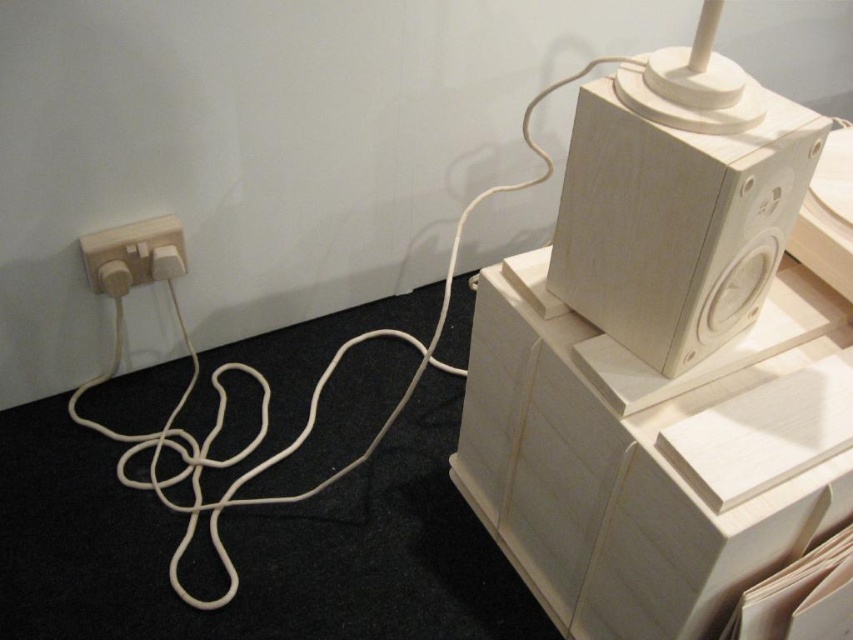
Between wooden speaker at upper right and white matte rope at lower left, which one appears on the right side from the viewer's perspective?

wooden speaker at upper right

Between wooden speaker at upper right and white matte rope at lower left, which one appears on the left side from the viewer's perspective?

white matte rope at lower left

Is point (744, 324) positioned in front of point (457, 220)?

That is True.

Identify the location of wooden speaker at upper right. This screenshot has height=640, width=853. (676, 218).

Can you confirm if white matte rope at lower left is positioned above white matte electrical outlet at lower left?

Incorrect, white matte rope at lower left is not positioned above white matte electrical outlet at lower left.

Between white matte rope at lower left and white matte electrical outlet at lower left, which one is positioned higher?

white matte electrical outlet at lower left is higher up.

Does point (311, 403) come farther from viewer compared to point (91, 284)?

Yes, it is.

Where is `white matte rope at lower left`? This screenshot has width=853, height=640. white matte rope at lower left is located at coordinates (262, 388).

In the scene shown: Which is more to the left, wooden speaker at upper right or white matte electrical outlet at lower left?

white matte electrical outlet at lower left

Is wooden speaker at upper right positioned at the back of white matte electrical outlet at lower left?

No, it is not.

Is point (567, 173) more distant than point (143, 273)?

No.

At what (x,y) coordinates should I click in order to perform the action: click on wooden speaker at upper right. Please return your answer as a coordinate pair (x, y). Looking at the image, I should click on (676, 218).